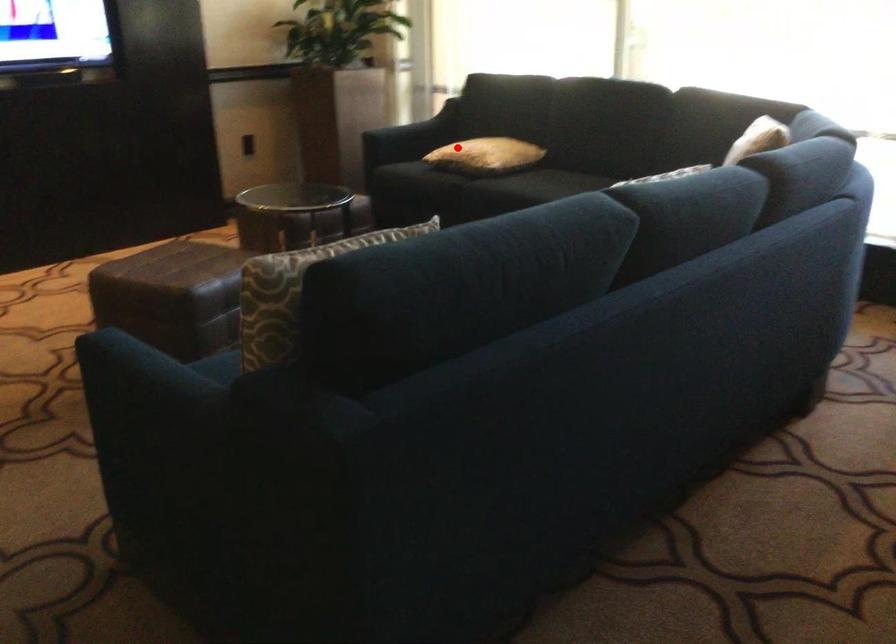
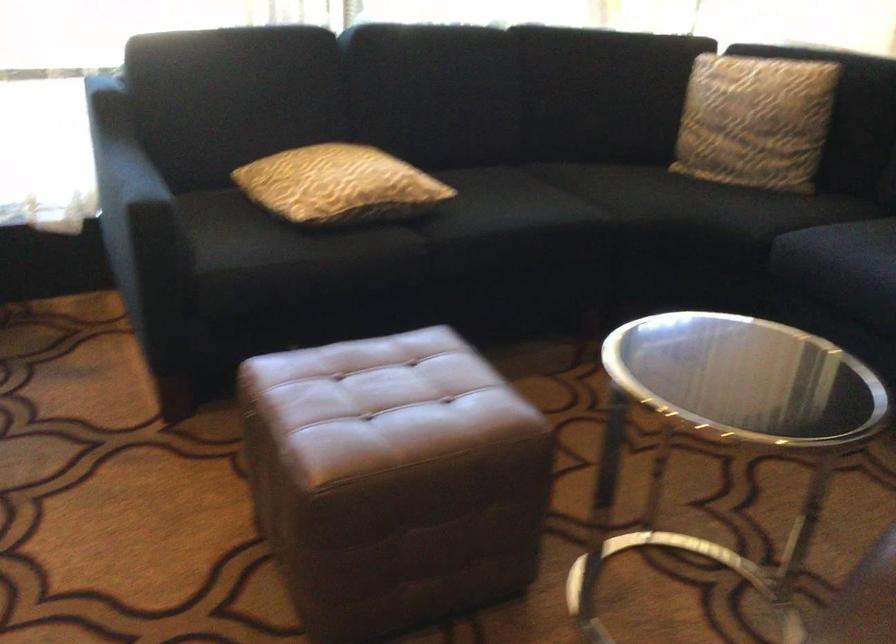
Locate, in the second image, the point that corresponds to the highlighted location in the first image.

(339, 185)